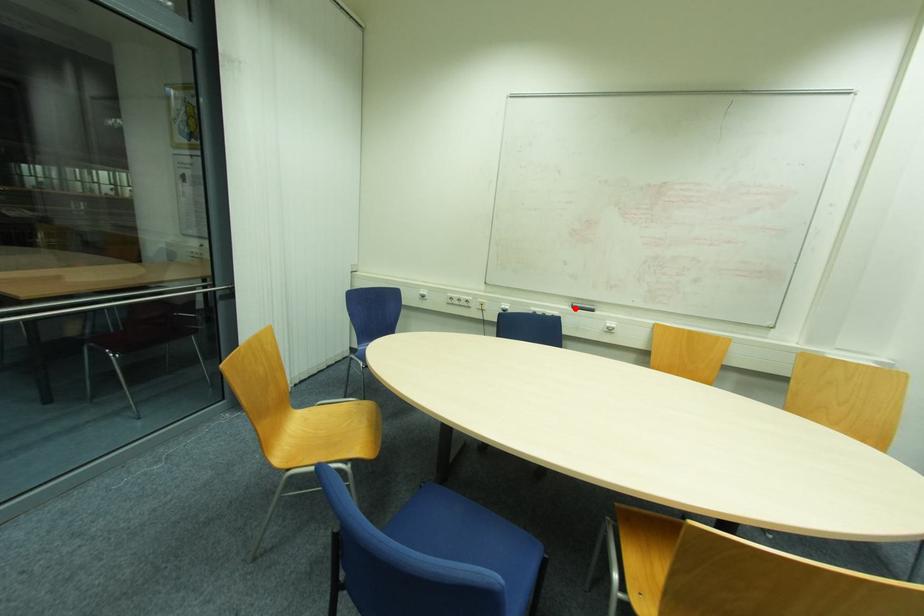
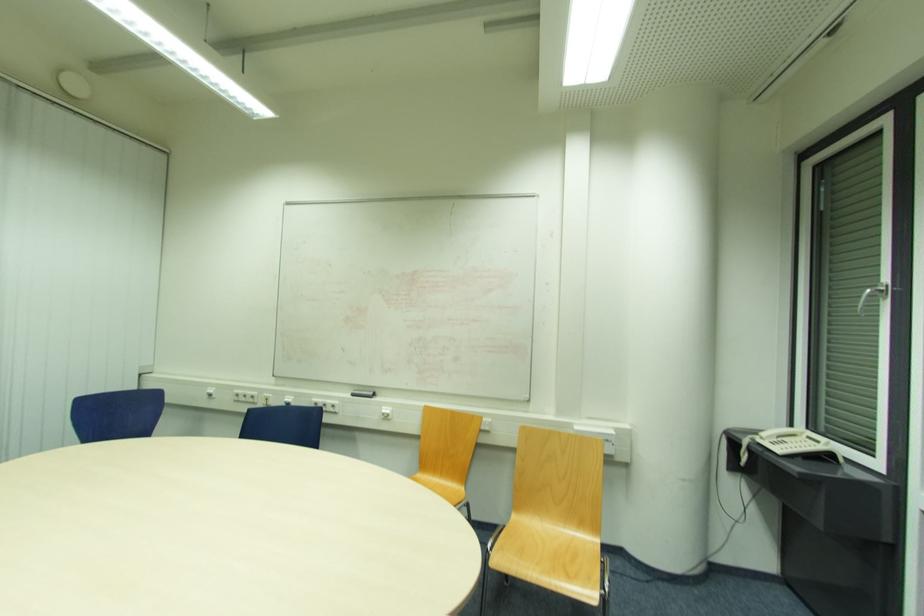
Question: A red point is marked in image1. In image2, is the corresponding 3D point closer to the camera or farther? Reply with the corresponding letter.

Choices:
 (A) The corresponding 3D point is closer.
 (B) The corresponding 3D point is farther.

Answer: (B)